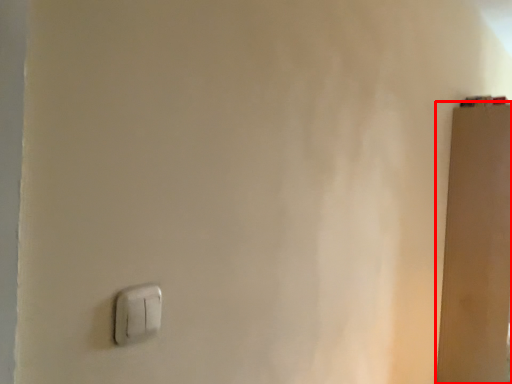
Question: From the image's perspective, considering the relative positions of door (annotated by the red box) and light switch in the image provided, where is door (annotated by the red box) located with respect to the staircase?

Choices:
 (A) below
 (B) above

Answer: (A)